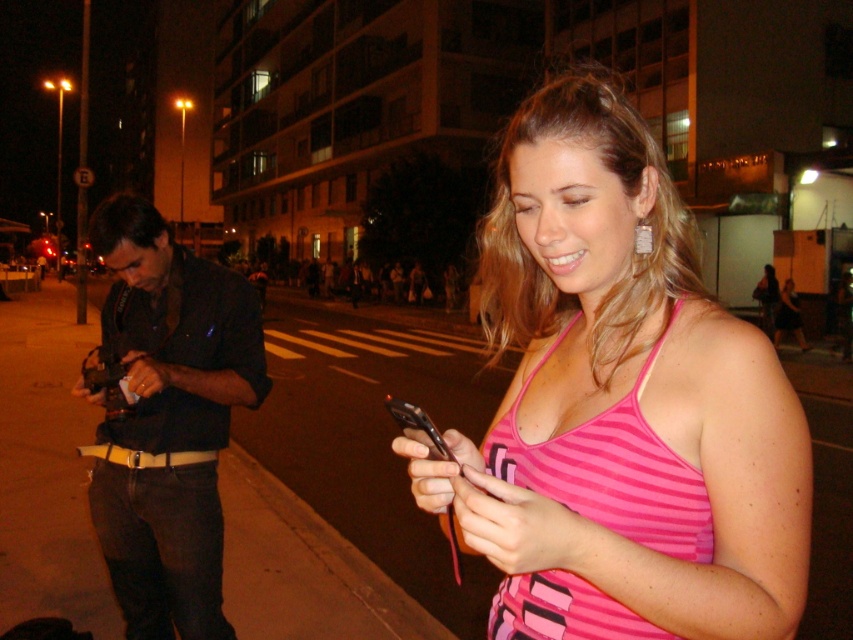
Question: Which of the following is the closest to the observer?

Choices:
 (A) black plastic sign at upper center
 (B) black leather shirt at left

Answer: (B)

Question: Is pink striped tank top at center further to camera compared to black leather shirt at left?

Choices:
 (A) no
 (B) yes

Answer: (A)

Question: Can you confirm if pink striped tank top at center is positioned above black plastic sign at upper center?

Choices:
 (A) yes
 (B) no

Answer: (B)

Question: Among these objects, which one is farthest from the camera?

Choices:
 (A) pink striped tank top at center
 (B) black plastic sign at upper center

Answer: (B)

Question: Which of these objects is positioned closest to the pink striped tank top at center?

Choices:
 (A) pink striped bikini top at center
 (B) black plastic sign at upper center
 (C) black leather shirt at left

Answer: (A)

Question: Is black leather shirt at left positioned at the back of black plastic sign at upper center?

Choices:
 (A) no
 (B) yes

Answer: (A)